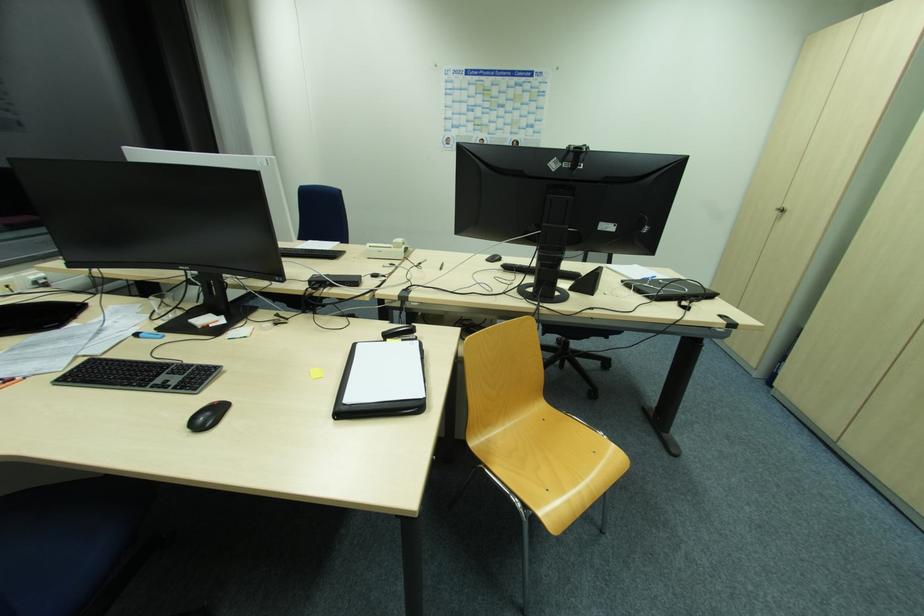
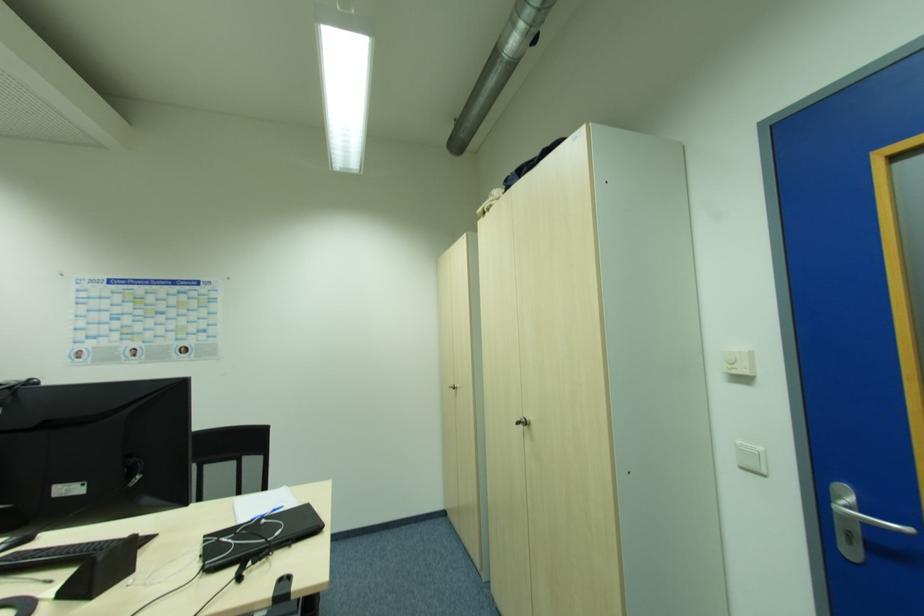
Find the pixel in the second image that matches point 663,282 in the first image.

(265, 521)